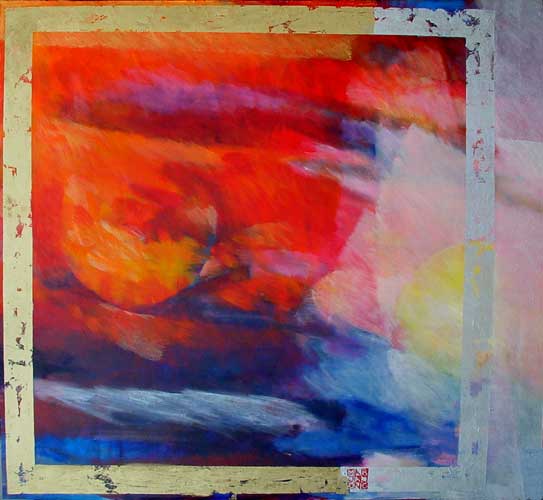
This screenshot has height=500, width=543. I want to click on frame, so click(x=409, y=23).